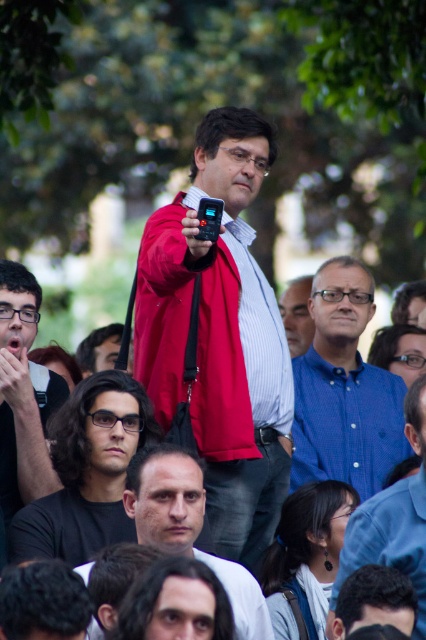
Which is more to the right, smooth black hair at center or blue button-down shirt at center-right?

Result: blue button-down shirt at center-right is more to the right.

Is smooth black hair at center in front of blue button-down shirt at center-right?

No, smooth black hair at center is further to the viewer.

At what (x,y) coordinates should I click in order to perform the action: click on smooth black hair at center. Please return your answer as a coordinate pair (x, y). The image size is (426, 640). Looking at the image, I should click on (187, 528).

Which is more to the left, matte black phone at center or matte black glasses at left?

matte black glasses at left

Is matte black phone at center thinner than matte black glasses at left?

Incorrect, matte black phone at center's width is not less than matte black glasses at left's.

What do you see at coordinates (221, 337) in the screenshot?
I see `matte black phone at center` at bounding box center [221, 337].

Where is `matte black phone at center`? The width and height of the screenshot is (426, 640). matte black phone at center is located at coordinates (221, 337).

Between black matte shirt at lower left and smooth black hair at center, which one has more height?

Standing taller between the two is black matte shirt at lower left.

Between black matte shirt at lower left and smooth black hair at center, which one is positioned lower?

smooth black hair at center

Does point (69, 536) come in front of point (193, 488)?

That is False.

Where is `black matte shirt at lower left`? This screenshot has width=426, height=640. black matte shirt at lower left is located at coordinates (88, 472).